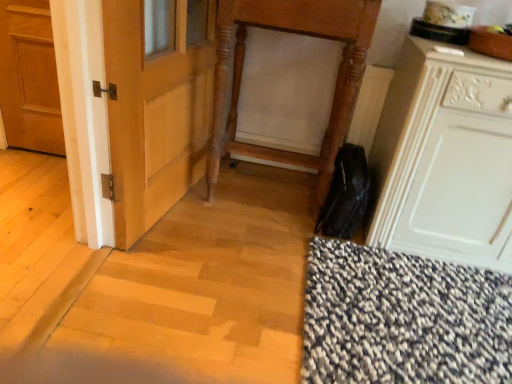
Question: Is matte wooden door at left smaller than white matte cabinet at lower right?

Choices:
 (A) no
 (B) yes

Answer: (B)

Question: Could you tell me if matte wooden door at left is turned towards white matte cabinet at lower right?

Choices:
 (A) no
 (B) yes

Answer: (A)

Question: Is matte wooden door at left shorter than white matte cabinet at lower right?

Choices:
 (A) no
 (B) yes

Answer: (B)

Question: Does matte wooden door at left lie in front of white matte cabinet at lower right?

Choices:
 (A) yes
 (B) no

Answer: (B)

Question: Does matte wooden door at left contain white matte cabinet at lower right?

Choices:
 (A) no
 (B) yes

Answer: (A)

Question: From a real-world perspective, is matte wooden door at left above or below wooden carved vanity at center?

Choices:
 (A) below
 (B) above

Answer: (A)

Question: Is matte wooden door at left wider or thinner than wooden carved vanity at center?

Choices:
 (A) thin
 (B) wide

Answer: (A)

Question: In the image, is matte wooden door at left positioned in front of or behind wooden carved vanity at center?

Choices:
 (A) behind
 (B) front

Answer: (A)

Question: Would you say matte wooden door at left is inside or outside wooden carved vanity at center?

Choices:
 (A) outside
 (B) inside

Answer: (A)

Question: From the image's perspective, is matte wooden door at left positioned above or below white matte cabinet at lower right?

Choices:
 (A) below
 (B) above

Answer: (B)

Question: Is matte wooden door at left to the left or to the right of white matte cabinet at lower right in the image?

Choices:
 (A) left
 (B) right

Answer: (A)

Question: From a real-world perspective, is matte wooden door at left positioned above or below white matte cabinet at lower right?

Choices:
 (A) above
 (B) below

Answer: (B)

Question: Considering their positions, is matte wooden door at left located in front of or behind white matte cabinet at lower right?

Choices:
 (A) front
 (B) behind

Answer: (B)

Question: Does point (476, 165) appear closer or farther from the camera than point (296, 8)?

Choices:
 (A) closer
 (B) farther

Answer: (A)

Question: Is white matte cabinet at lower right bigger or smaller than wooden carved vanity at center?

Choices:
 (A) small
 (B) big

Answer: (B)